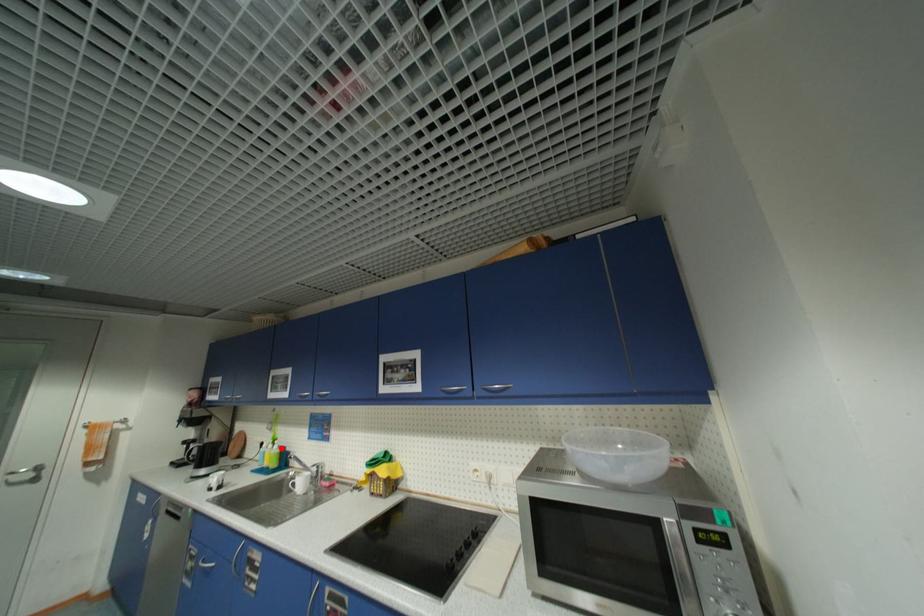
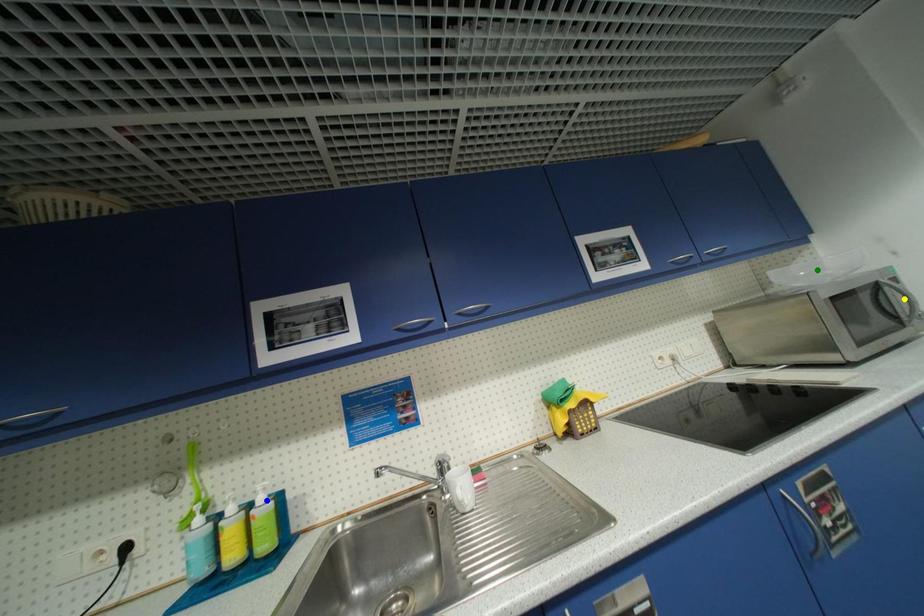
Question: I am providing you with two images of the same scene from different viewpoints. A red point is marked on the first image. You are given multiple points on the second image. Which spot in image 2 lines up with the point in image 1?

Choices:
 (A) blue point
 (B) green point
 (C) yellow point

Answer: (A)